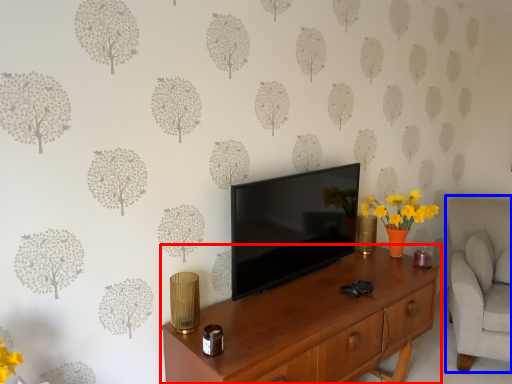
Question: Which object appears closest to the camera in this image, desk (highlighted by a red box) or swivel chair (highlighted by a blue box)?

Choices:
 (A) desk
 (B) swivel chair

Answer: (A)